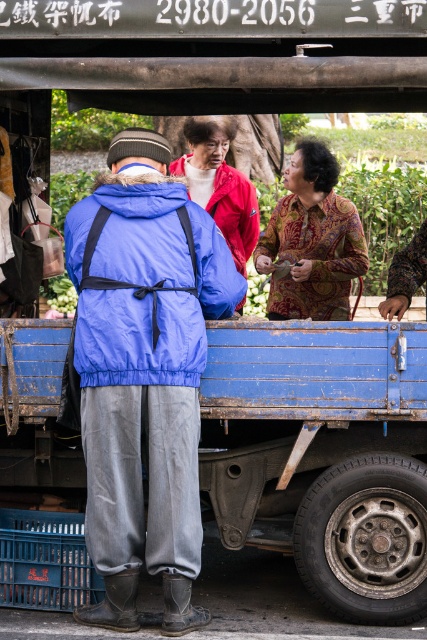
Question: Among these objects, which one is farthest from the camera?

Choices:
 (A) blue fabric jacket at center
 (B) batik-patterned fabric at center

Answer: (B)

Question: Which object appears closest to the camera in this image?

Choices:
 (A) batik-patterned fabric at center
 (B) blue fabric jacket at center

Answer: (B)

Question: Can you confirm if blue fabric jacket at center is wider than batik-patterned fabric at center?

Choices:
 (A) yes
 (B) no

Answer: (A)

Question: Does blue fabric jacket at center come in front of batik-patterned fabric at center?

Choices:
 (A) yes
 (B) no

Answer: (A)

Question: Considering the relative positions of blue fabric jacket at center and batik-patterned fabric at center in the image provided, where is blue fabric jacket at center located with respect to batik-patterned fabric at center?

Choices:
 (A) above
 (B) below

Answer: (B)

Question: Which point is farther from the camera taking this photo?

Choices:
 (A) (117, 595)
 (B) (289, 244)

Answer: (B)